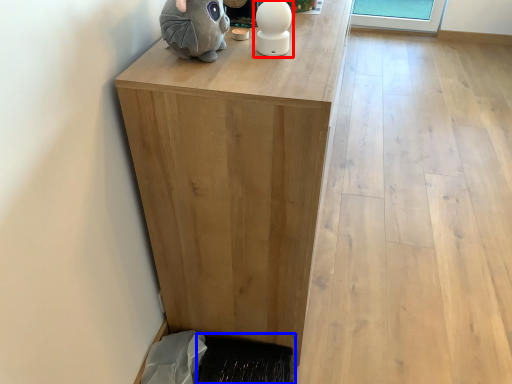
Question: Which object is further to the camera taking this photo, figurine (highlighted by a red box) or doormat (highlighted by a blue box)?

Choices:
 (A) figurine
 (B) doormat

Answer: (B)